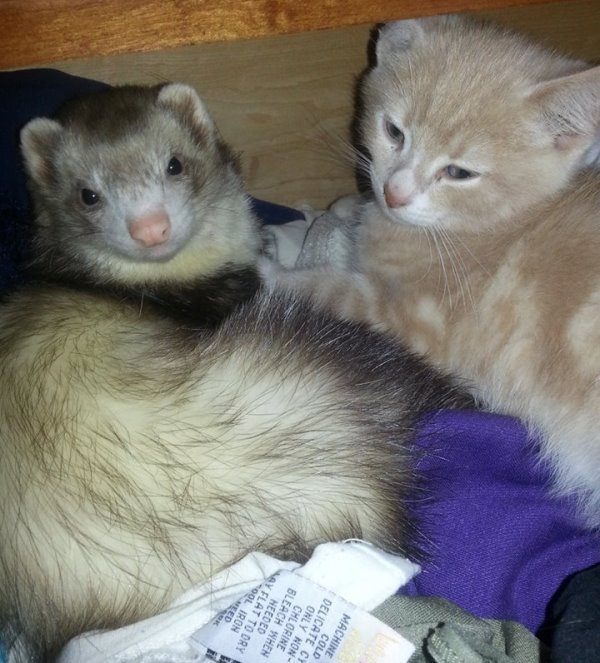
The height and width of the screenshot is (663, 600). In order to click on white cloth in this screenshot , I will do `click(147, 627)`.